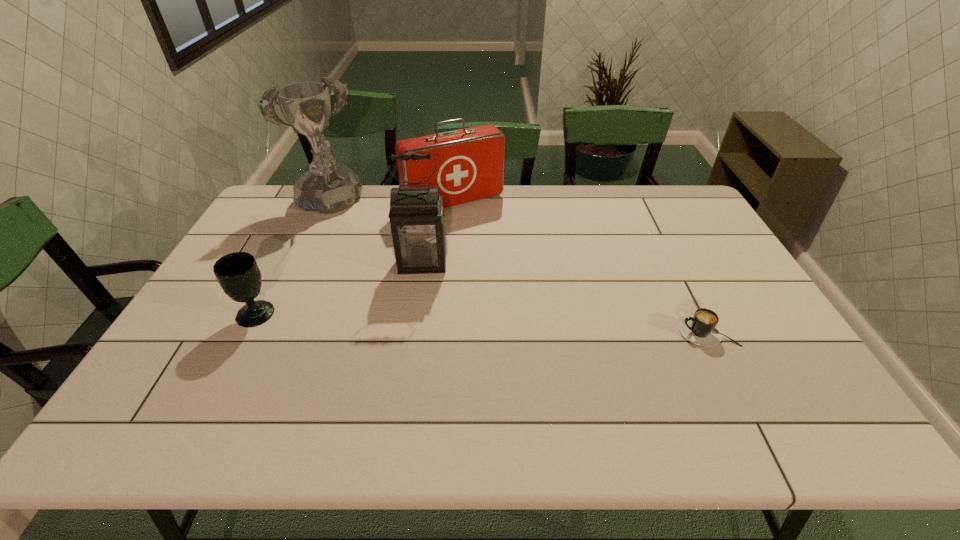
At what (x,y) coordinates should I click in order to perform the action: click on award located at the far edge. Please return your answer as a coordinate pair (x, y). The height and width of the screenshot is (540, 960). Looking at the image, I should click on (328, 187).

You are a GUI agent. You are given a task and a screenshot of the screen. Output one action in this format:
    pyautogui.click(x=<x>, y=<y>)
    Task: Click on the first-aid kit that is at the far edge
    
    Given the screenshot: What is the action you would take?
    pyautogui.click(x=470, y=162)

Identify the location of chalice positioned at the left edge. Image resolution: width=960 pixels, height=540 pixels. (238, 274).

Find the location of a particular element. The width and height of the screenshot is (960, 540). award present at the left edge is located at coordinates (328, 187).

You are a GUI agent. You are given a task and a screenshot of the screen. Output one action in this format:
    pyautogui.click(x=<x>, y=<y>)
    Task: Click on the object that is at the right edge
    This screenshot has height=540, width=960.
    Given the screenshot: What is the action you would take?
    pyautogui.click(x=701, y=329)

Where is `object situated at the far left corner`? object situated at the far left corner is located at coordinates (328, 187).

Identify the location of free space at the far edge of the desktop. (599, 194).

Locate an element on the screen. free space at the near edge of the desktop is located at coordinates (660, 370).

Find the location of a particular element. This screenshot has width=960, height=540. free space at the left edge of the desktop is located at coordinates (222, 305).

At what (x,y) coordinates should I click in order to perform the action: click on vacant space at the right edge of the desktop. Please return your answer as a coordinate pair (x, y). Looking at the image, I should click on (700, 227).